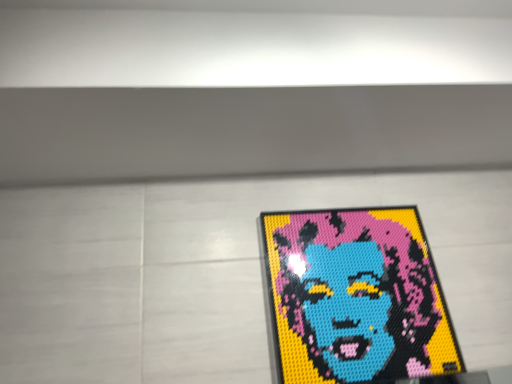
Find the location of a particular element. Image resolution: width=512 pixels, height=384 pixels. brick mosaic portrait at lower right is located at coordinates (356, 297).

What is the approximate width of brick mosaic portrait at lower right?

The width of brick mosaic portrait at lower right is 1.26 inches.

What do you see at coordinates (356, 297) in the screenshot?
I see `brick mosaic portrait at lower right` at bounding box center [356, 297].

Identify the location of brick mosaic portrait at lower right. (356, 297).